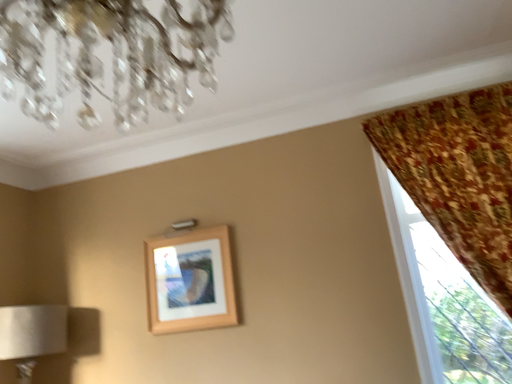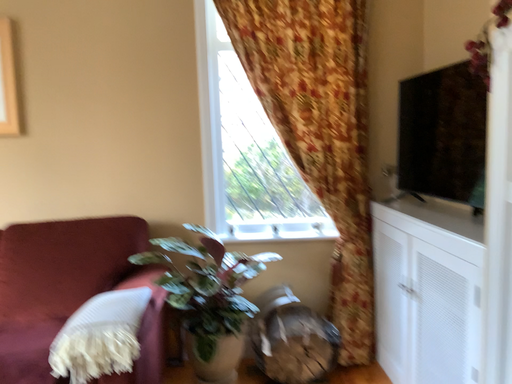
Question: Which way did the camera rotate in the video?

Choices:
 (A) rotated left
 (B) rotated right

Answer: (B)